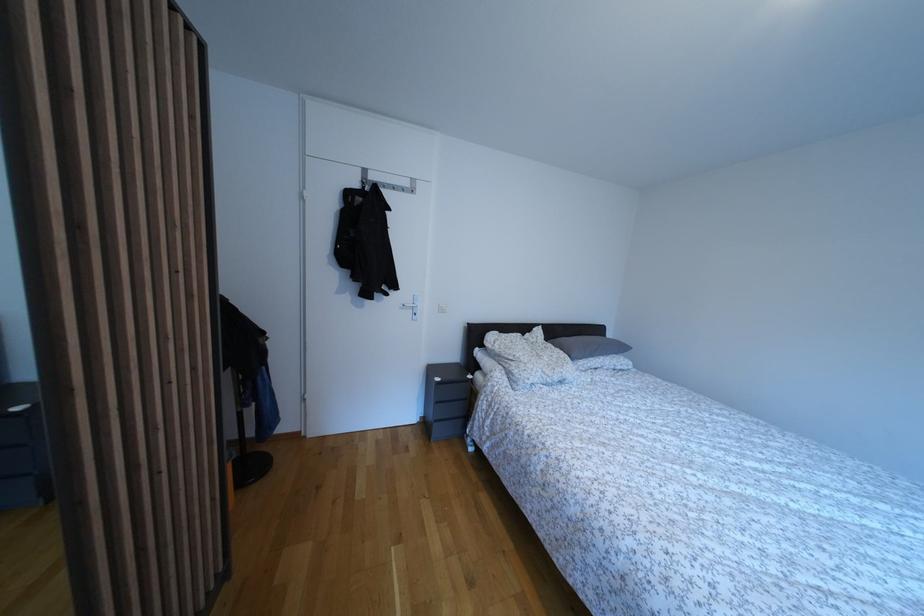
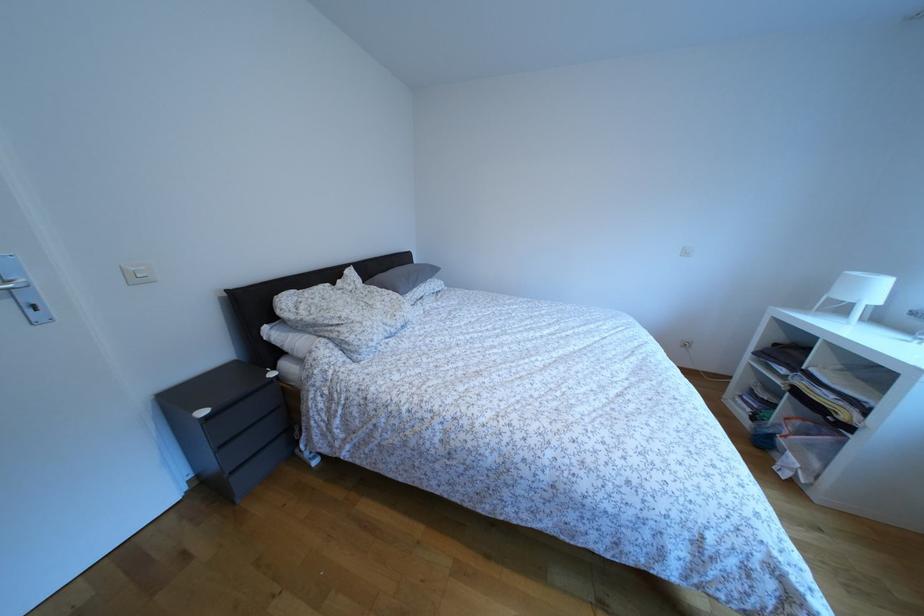
Based on the continuous images, in which direction is the camera rotating?

The camera rotated toward right-down.